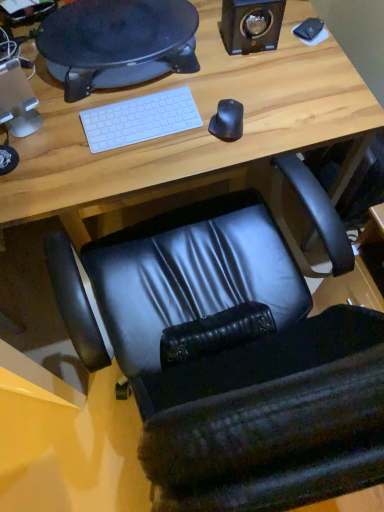
Where is `free space that is to the left of black matte speaker at upper right`? free space that is to the left of black matte speaker at upper right is located at coordinates (198, 57).